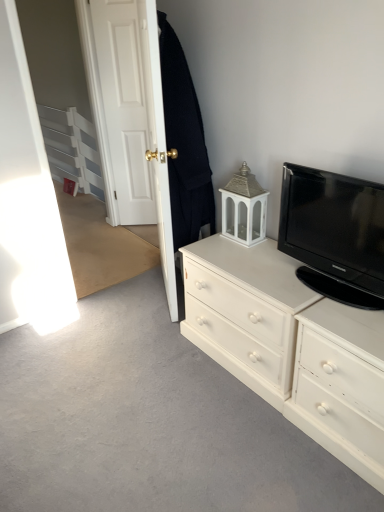
Question: From the image's perspective, would you say black woolen robe at upper left is positioned over white painted wood drawer at right?

Choices:
 (A) no
 (B) yes

Answer: (B)

Question: From a real-world perspective, is black woolen robe at upper left physically above white painted wood drawer at right?

Choices:
 (A) yes
 (B) no

Answer: (A)

Question: From the image's perspective, is black woolen robe at upper left beneath white painted wood drawer at right?

Choices:
 (A) no
 (B) yes

Answer: (A)

Question: Can you confirm if black woolen robe at upper left is smaller than white painted wood drawer at right?

Choices:
 (A) yes
 (B) no

Answer: (A)

Question: Does black woolen robe at upper left have a greater width compared to white painted wood drawer at right?

Choices:
 (A) yes
 (B) no

Answer: (B)

Question: Is black woolen robe at upper left positioned in front of white painted wood drawer at right?

Choices:
 (A) no
 (B) yes

Answer: (A)

Question: From the image's perspective, would you say white painted wood drawer at right is shown under white painted wood chest of drawers at right?

Choices:
 (A) no
 (B) yes

Answer: (B)

Question: Can you confirm if white painted wood drawer at right is positioned to the left of white painted wood chest of drawers at right?

Choices:
 (A) yes
 (B) no

Answer: (B)

Question: Is white painted wood drawer at right facing towards white painted wood chest of drawers at right?

Choices:
 (A) no
 (B) yes

Answer: (A)

Question: Is white painted wood drawer at right at the right side of white painted wood chest of drawers at right?

Choices:
 (A) yes
 (B) no

Answer: (A)

Question: Would you say white painted wood drawer at right is a long distance from white painted wood chest of drawers at right?

Choices:
 (A) no
 (B) yes

Answer: (A)

Question: Does white painted wood drawer at right have a lesser height compared to white painted wood chest of drawers at right?

Choices:
 (A) yes
 (B) no

Answer: (A)

Question: From the image's perspective, is black woolen robe at upper left under white painted wood chest of drawers at right?

Choices:
 (A) no
 (B) yes

Answer: (A)